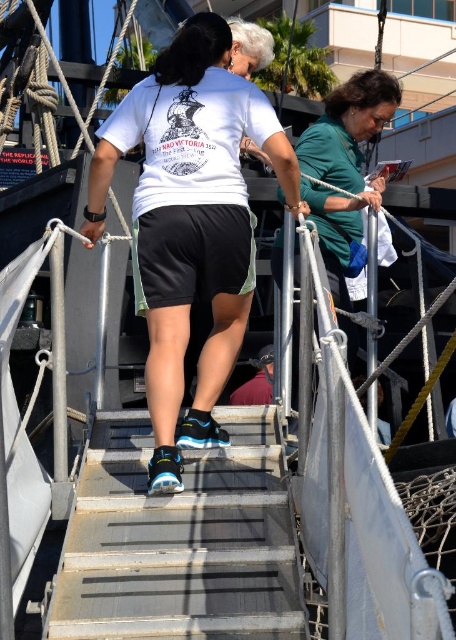
Consider the image. Can you confirm if metallic gray stairs at center is wider than green matte shirt at upper right?

Incorrect, metallic gray stairs at center's width does not surpass green matte shirt at upper right's.

From the picture: Which is below, metallic gray stairs at center or green matte shirt at upper right?

Positioned lower is metallic gray stairs at center.

The image size is (456, 640). What do you see at coordinates (180, 540) in the screenshot? I see `metallic gray stairs at center` at bounding box center [180, 540].

Where is `metallic gray stairs at center`? metallic gray stairs at center is located at coordinates (180, 540).

Is white matte t-shirt at center to the left of green matte shirt at upper right from the viewer's perspective?

Yes, white matte t-shirt at center is to the left of green matte shirt at upper right.

In the scene shown: Who is lower down, white matte t-shirt at center or green matte shirt at upper right?

white matte t-shirt at center

The image size is (456, 640). Identify the location of white matte t-shirt at center. (190, 221).

Does white matte t-shirt at center appear over metallic gray stairs at center?

Yes, white matte t-shirt at center is above metallic gray stairs at center.

Is point (195, 269) in front of point (128, 596)?

No, it is behind (128, 596).

The width and height of the screenshot is (456, 640). Identify the location of white matte t-shirt at center. (190, 221).